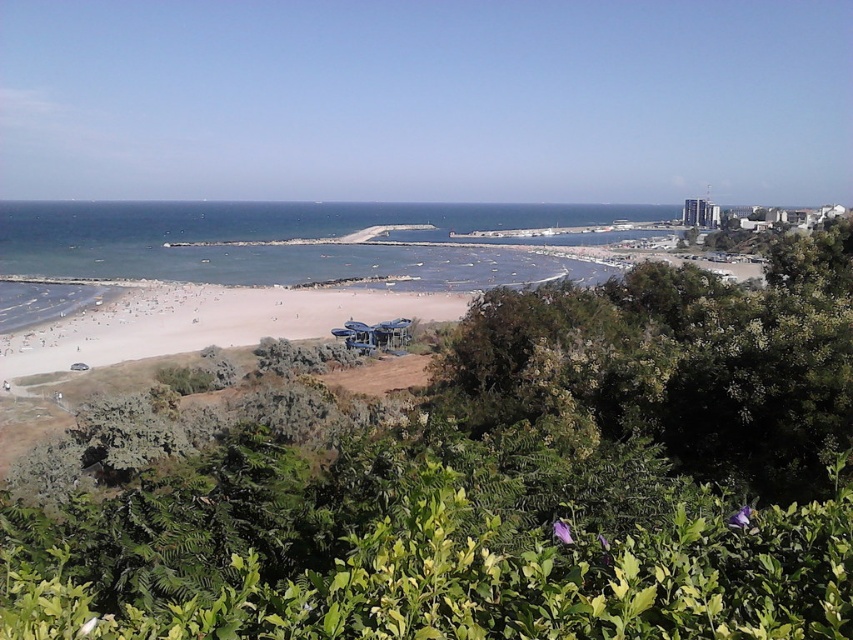
Measure the distance between green leafy bush at center and blue water at center.

The distance of green leafy bush at center from blue water at center is 1004.03 feet.

Between green leafy bush at center and blue water at center, which one has more height?

blue water at center

Between point (120, 564) and point (93, 260), which one is positioned behind?

The point (93, 260) is more distant.

Where is `green leafy bush at center`? green leafy bush at center is located at coordinates (509, 486).

Measure the distance from blue water at center to light beige sand at center.

blue water at center is 385.97 feet from light beige sand at center.

This screenshot has height=640, width=853. What do you see at coordinates (299, 237) in the screenshot?
I see `blue water at center` at bounding box center [299, 237].

I want to click on blue water at center, so click(x=299, y=237).

Who is more forward, (717, 582) or (4, 362)?

Point (717, 582) is more forward.

Where is `green leafy bush at center`? green leafy bush at center is located at coordinates (509, 486).